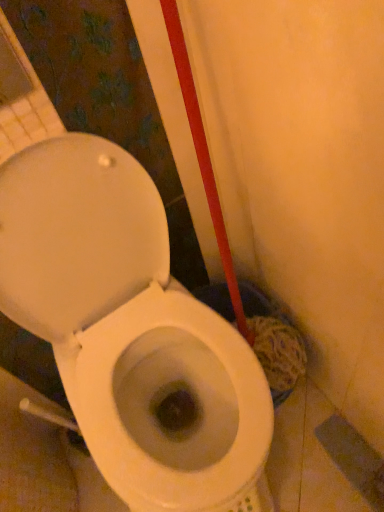
Locate an element on the screen. white glossy toilet at center is located at coordinates (129, 330).

This screenshot has height=512, width=384. Describe the element at coordinates (129, 330) in the screenshot. I see `white glossy toilet at center` at that location.

Measure the distance between white glossy toilet at center and camera.

They are 26.44 inches apart.

Image resolution: width=384 pixels, height=512 pixels. In order to click on white glossy toilet at center in this screenshot , I will do (x=129, y=330).